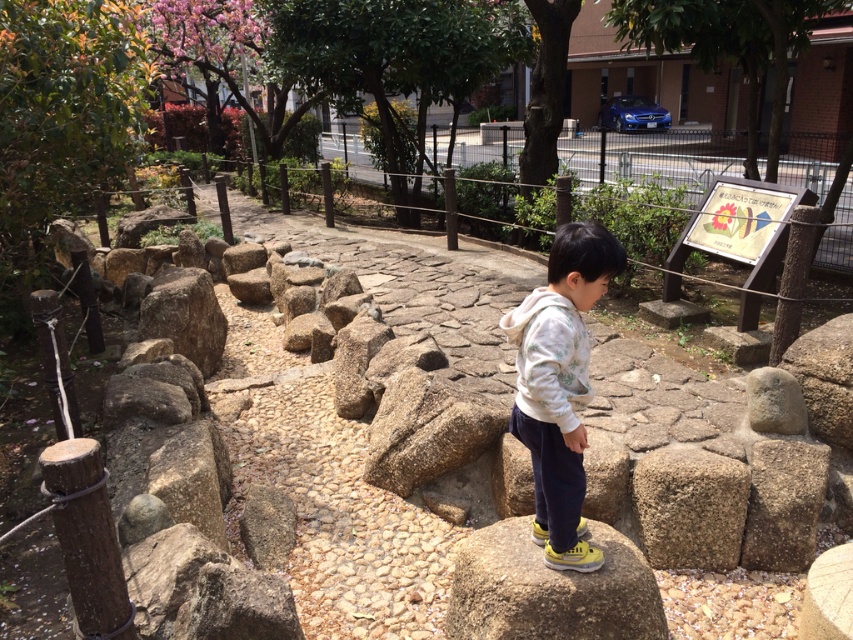
Which is above, white fleece jacket at center or brown rough stone at center?

white fleece jacket at center is above.

Can you confirm if white fleece jacket at center is positioned to the left of brown rough stone at center?

Indeed, white fleece jacket at center is positioned on the left side of brown rough stone at center.

This screenshot has width=853, height=640. What do you see at coordinates (560, 385) in the screenshot?
I see `white fleece jacket at center` at bounding box center [560, 385].

Image resolution: width=853 pixels, height=640 pixels. In order to click on white fleece jacket at center in this screenshot , I will do `click(560, 385)`.

Where is `smooth gray rock at center`? smooth gray rock at center is located at coordinates (550, 589).

Is smooth gray rock at center below rough stone boulder at center-left?

Indeed, smooth gray rock at center is positioned under rough stone boulder at center-left.

Is point (518, 620) in front of point (190, 294)?

Yes, it is.

Where is `smooth gray rock at center`? Image resolution: width=853 pixels, height=640 pixels. smooth gray rock at center is located at coordinates (550, 589).

Does brown rough stone at center appear under rough stone boulder at center-left?

Correct, brown rough stone at center is located below rough stone boulder at center-left.

Between brown rough stone at center and rough stone boulder at center-left, which one has more height?

rough stone boulder at center-left

Who is more forward, (735, 508) or (161, 321)?

Positioned in front is point (735, 508).

At what (x,y) coordinates should I click in order to perform the action: click on brown rough stone at center. Please return your answer as a coordinate pair (x, y). The width and height of the screenshot is (853, 640). Looking at the image, I should click on (689, 508).